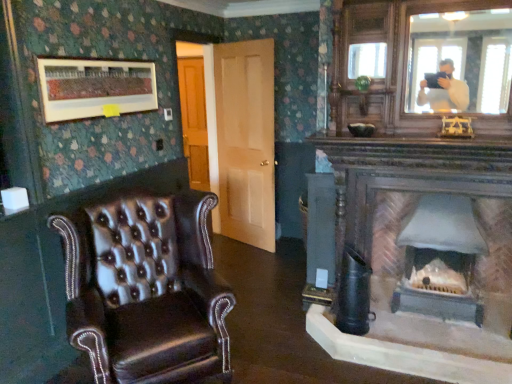
Where is `light brown wood door at center`? The height and width of the screenshot is (384, 512). light brown wood door at center is located at coordinates (246, 140).

You are a GUI agent. You are given a task and a screenshot of the screen. Output one action in this format:
    pyautogui.click(x=<x>, y=<y>)
    Task: Click on the matte wooden picture frame at upper left
    This screenshot has height=384, width=512.
    Given the screenshot: What is the action you would take?
    pyautogui.click(x=95, y=87)

Where is `light brown wood door at center`? This screenshot has width=512, height=384. light brown wood door at center is located at coordinates (246, 140).

From the image's perspective, relative to matte wooden picture frame at upper left, is matte gray stone fireplace at center above or below?

From the image's perspective, matte gray stone fireplace at center appears below matte wooden picture frame at upper left.

From the picture: Which is correct: matte gray stone fireplace at center is inside matte wooden picture frame at upper left, or outside of it?

matte gray stone fireplace at center lies outside matte wooden picture frame at upper left.

Which is more to the left, matte gray stone fireplace at center or matte wooden picture frame at upper left?

Positioned to the left is matte wooden picture frame at upper left.

Can you confirm if leather wingback chair at left is thinner than light brown wood door at center?

Incorrect, the width of leather wingback chair at left is not less than that of light brown wood door at center.

From a real-world perspective, is leather wingback chair at left below light brown wood door at center?

Yes, from a real-world perspective, leather wingback chair at left is under light brown wood door at center.

Considering the relative sizes of leather wingback chair at left and light brown wood door at center in the image provided, is leather wingback chair at left taller than light brown wood door at center?

No.

Find the location of a particular element. Image resolution: width=512 pixels, height=384 pixels. chair below the light brown wood door at center (from the image's perspective) is located at coordinates (146, 290).

Between leather wingback chair at left and matte gray stone fireplace at center, which one has smaller size?

matte gray stone fireplace at center.

Based on the photo, how far apart are leather wingback chair at left and matte gray stone fireplace at center?

leather wingback chair at left is 5.50 feet away from matte gray stone fireplace at center.

Is point (174, 330) in front of point (445, 211)?

Yes, point (174, 330) is in front of point (445, 211).

From the image's perspective, relative to matte gray stone fireplace at center, is leather wingback chair at left above or below?

From the image's perspective, leather wingback chair at left appears below matte gray stone fireplace at center.

Is matte gray stone fireplace at center looking in the opposite direction of leather wingback chair at left?

No, leather wingback chair at left is not at the back of matte gray stone fireplace at center.

Is matte gray stone fireplace at center smaller than leather wingback chair at left?

Indeed, matte gray stone fireplace at center has a smaller size compared to leather wingback chair at left.

Between matte gray stone fireplace at center and leather wingback chair at left, which one has more height?

leather wingback chair at left.

What's the angular difference between matte gray stone fireplace at center and leather wingback chair at left's facing directions?

The facing directions of matte gray stone fireplace at center and leather wingback chair at left are 47.5 degrees apart.

Considering the relative positions of matte gray stone fireplace at center and light brown wood door at center in the image provided, is matte gray stone fireplace at center behind light brown wood door at center?

No, matte gray stone fireplace at center is in front of light brown wood door at center.

Is light brown wood door at center surrounded by matte gray stone fireplace at center?

No, matte gray stone fireplace at center does not contain light brown wood door at center.

From the image's perspective, which object appears higher, matte gray stone fireplace at center or light brown wood door at center?

light brown wood door at center appears higher in the image.

Are matte gray stone fireplace at center and light brown wood door at center located far from each other?

Absolutely, matte gray stone fireplace at center is distant from light brown wood door at center.

Does matte wooden picture frame at upper left contain light brown wood door at center?

No, light brown wood door at center is not surrounded by matte wooden picture frame at upper left.

Considering the positions of objects matte wooden picture frame at upper left and light brown wood door at center in the image provided, who is in front, matte wooden picture frame at upper left or light brown wood door at center?

Positioned in front is matte wooden picture frame at upper left.

The image size is (512, 384). I want to click on picture frame on the left of light brown wood door at center, so click(95, 87).

From the image's perspective, is matte wooden picture frame at upper left located above light brown wood door at center?

Correct, matte wooden picture frame at upper left appears higher than light brown wood door at center in the image.

Does point (274, 248) come in front of point (426, 300)?

No, it is not.

From the image's perspective, is light brown wood door at center above matte gray stone fireplace at center?

Yes, from the image's perspective, light brown wood door at center is above matte gray stone fireplace at center.

Does light brown wood door at center turn towards matte gray stone fireplace at center?

No, light brown wood door at center does not turn towards matte gray stone fireplace at center.

In order to click on picture frame on the left of matte gray stone fireplace at center in this screenshot , I will do `click(95, 87)`.

Locate an element on the screen. door that appears on the right of leather wingback chair at left is located at coordinates (246, 140).

When comparing their distances from light brown wood door at center, does leather wingback chair at left or matte wooden picture frame at upper left seem closer?

matte wooden picture frame at upper left is positioned closer to the anchor light brown wood door at center.

Looking at the image, which one is located closer to light brown wood door at center, matte gray stone fireplace at center or matte wooden picture frame at upper left?

matte wooden picture frame at upper left lies closer to light brown wood door at center than the other object.

From the image, which object appears to be nearer to leather wingback chair at left, matte gray stone fireplace at center or matte wooden picture frame at upper left?

matte wooden picture frame at upper left is closer to leather wingback chair at left.

From the image, which object appears to be farther from matte wooden picture frame at upper left, leather wingback chair at left or light brown wood door at center?

light brown wood door at center lies further to matte wooden picture frame at upper left than the other object.

Looking at the image, which one is located closer to light brown wood door at center, leather wingback chair at left or matte gray stone fireplace at center?

matte gray stone fireplace at center is positioned closer to the anchor light brown wood door at center.

Based on the photo, which object lies nearer to the anchor point leather wingback chair at left, light brown wood door at center or matte wooden picture frame at upper left?

matte wooden picture frame at upper left is positioned closer to the anchor leather wingback chair at left.

From the picture: Looking at the image, which one is located closer to matte wooden picture frame at upper left, matte gray stone fireplace at center or light brown wood door at center?

light brown wood door at center is closer to matte wooden picture frame at upper left.

Estimate the real-world distances between objects in this image. Which object is closer to matte wooden picture frame at upper left, leather wingback chair at left or matte gray stone fireplace at center?

leather wingback chair at left.

In order to click on door between matte wooden picture frame at upper left and matte gray stone fireplace at center in this screenshot , I will do `click(246, 140)`.

This screenshot has width=512, height=384. I want to click on picture frame between leather wingback chair at left and light brown wood door at center in the front-back direction, so click(95, 87).

The width and height of the screenshot is (512, 384). Identify the location of door between leather wingback chair at left and matte gray stone fireplace at center. (246, 140).

I want to click on chair between matte wooden picture frame at upper left and matte gray stone fireplace at center from left to right, so click(146, 290).